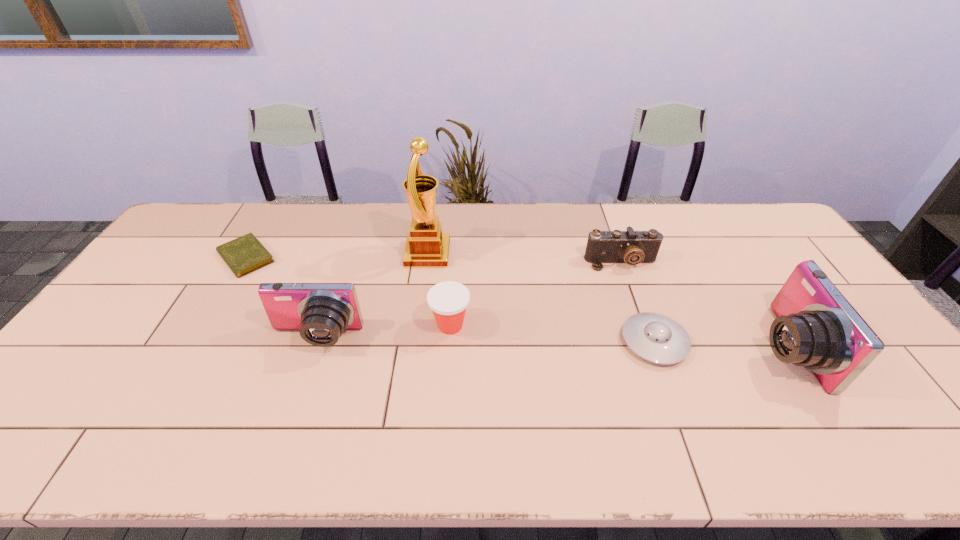
Find the location of a particular element. Image resolution: width=960 pixels, height=540 pixels. free space for an extra camera to achieve even spacing is located at coordinates (547, 343).